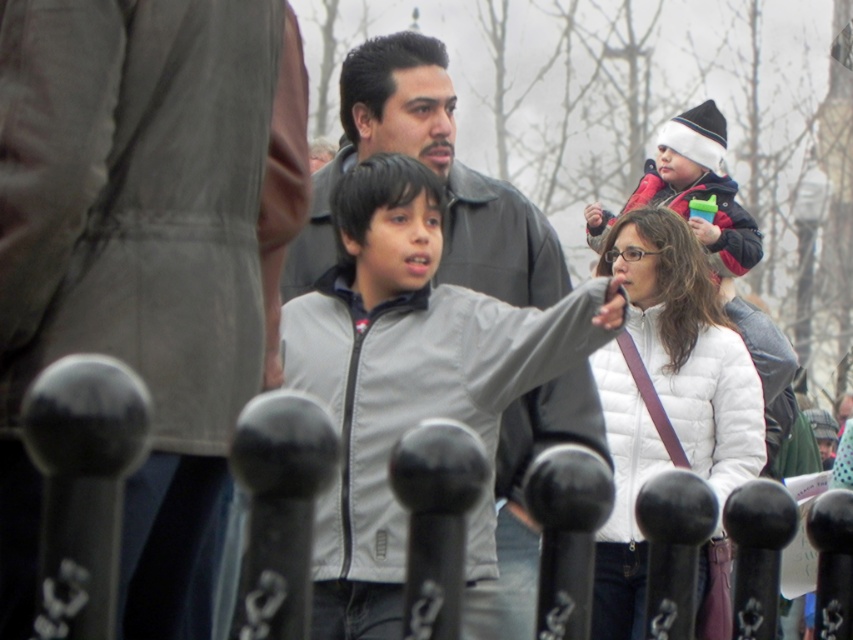
Question: Which object is the farthest from the light gray jacket at center?

Choices:
 (A) black metal fence at center
 (B) red fleece jacket at upper right
 (C) gray fabric jacket at center

Answer: (B)

Question: Does light gray jacket at center have a larger size compared to black metal fence at center?

Choices:
 (A) no
 (B) yes

Answer: (B)

Question: Is light gray jacket at center bigger than black metal fence at center?

Choices:
 (A) yes
 (B) no

Answer: (A)

Question: Does gray fabric jacket at center appear under red fleece jacket at upper right?

Choices:
 (A) yes
 (B) no

Answer: (A)

Question: Which of these objects is positioned farthest from the light gray jacket at center?

Choices:
 (A) black metal fence at center
 (B) red fleece jacket at upper right
 (C) gray fabric jacket at center

Answer: (B)

Question: Which object is closer to the camera taking this photo?

Choices:
 (A) gray fabric jacket at center
 (B) red fleece jacket at upper right

Answer: (A)